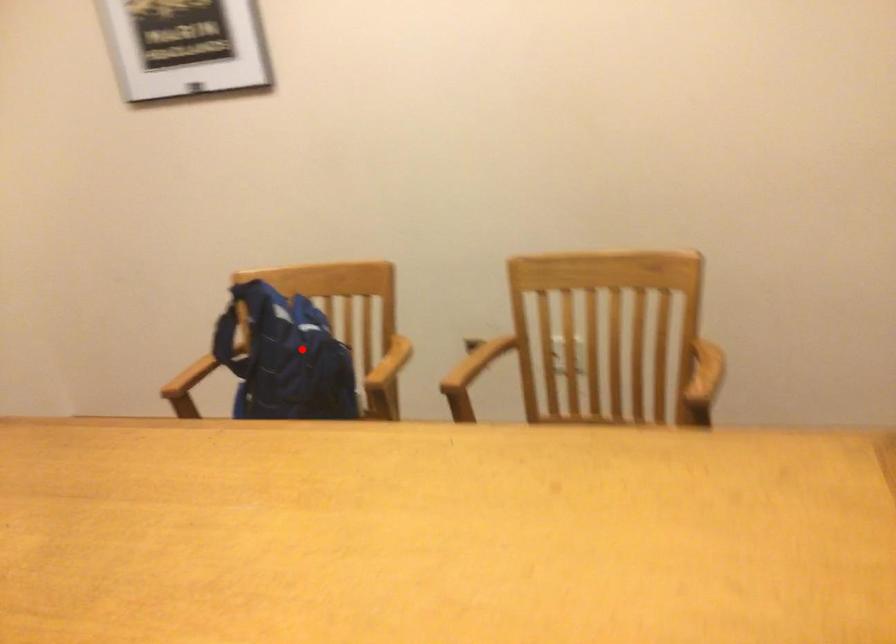
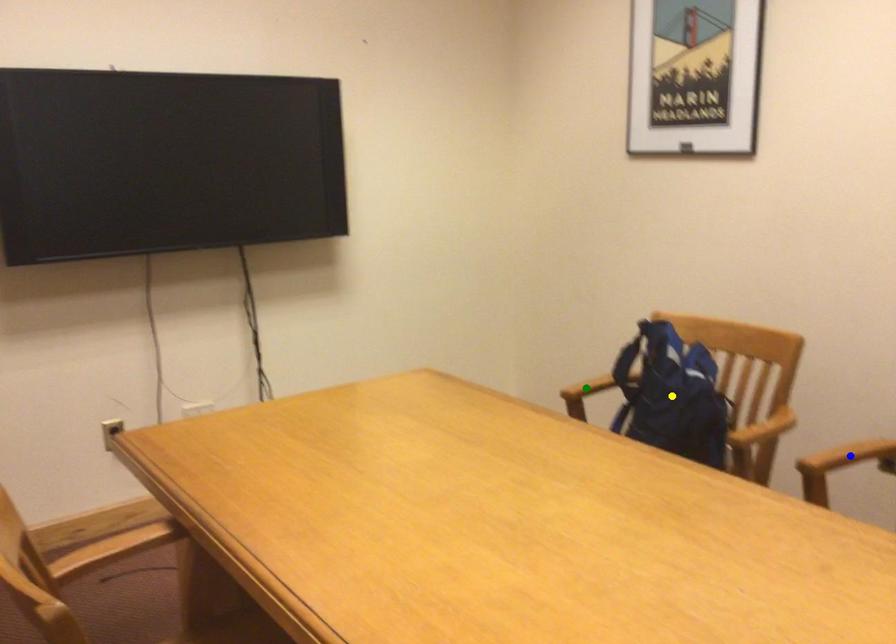
Question: I am providing you with two images of the same scene from different viewpoints. A red point is marked on the first image. You are given multiple points on the second image. Which mark in image 2 goes with the point in image 1?

Choices:
 (A) yellow point
 (B) green point
 (C) blue point

Answer: (A)